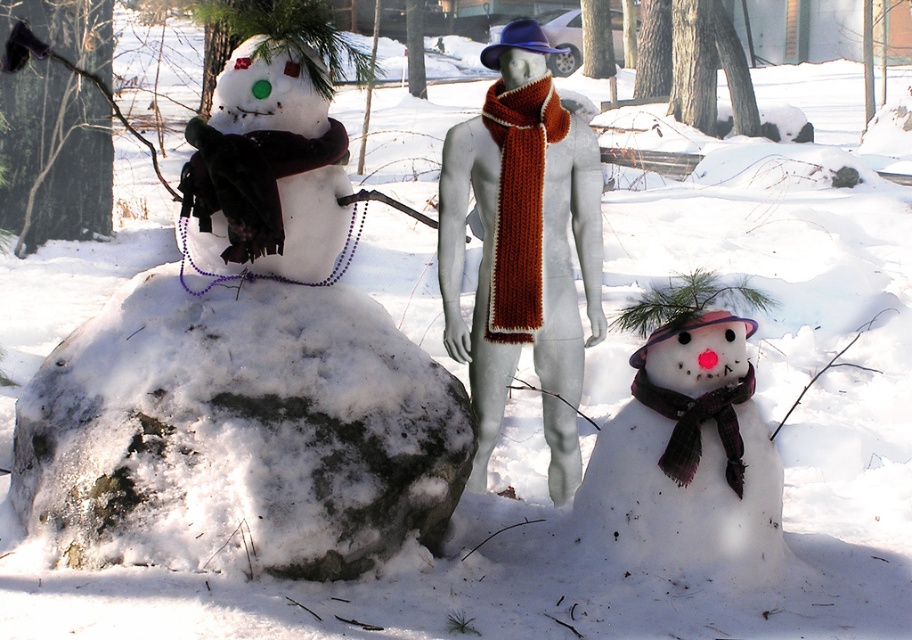
Question: Can you confirm if white fluffy snowman at left is smaller than matte brown scarf at lower right?

Choices:
 (A) no
 (B) yes

Answer: (A)

Question: Based on their relative distances, which object is nearer to the knitted orange scarf at center?

Choices:
 (A) white fluffy snowman at left
 (B) matte brown scarf at lower right
 (C) matte black scarf at left
 (D) knitted wool scarf at center

Answer: (D)

Question: Is matte brown scarf at lower right thinner than knitted orange scarf at center?

Choices:
 (A) yes
 (B) no

Answer: (B)

Question: Among these points, which one is nearest to the camera?

Choices:
 (A) pos(750,380)
 (B) pos(276,156)
 (C) pos(570,371)

Answer: (B)

Question: Among these objects, which one is nearest to the camera?

Choices:
 (A) plaid wool scarf at lower right
 (B) matte brown scarf at lower right

Answer: (B)

Question: Is matte brown scarf at lower right above knitted orange scarf at center?

Choices:
 (A) no
 (B) yes

Answer: (A)